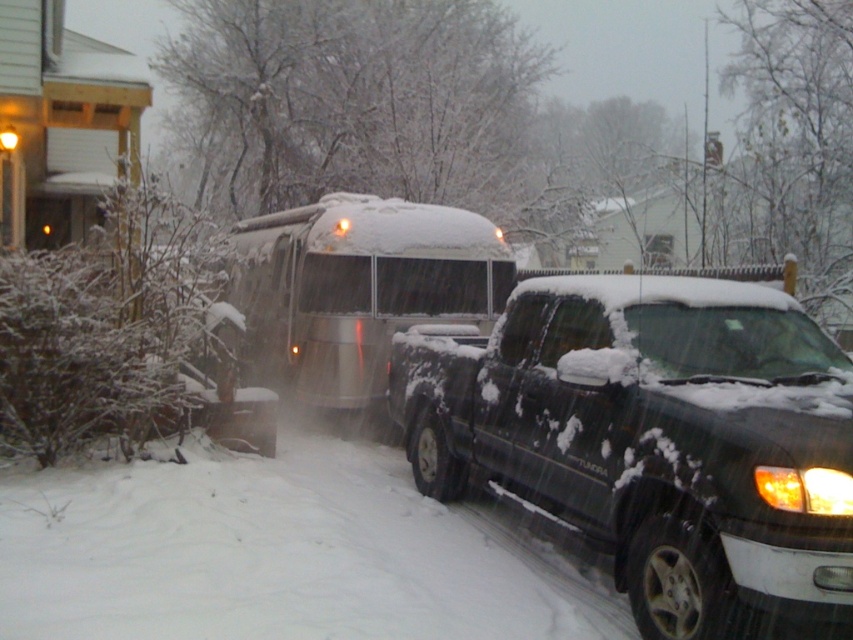
Is black matte truck at center positioned behind silver metallic bus at center?

No, it is in front of silver metallic bus at center.

Is the position of black matte truck at center less distant than that of silver metallic bus at center?

Yes, it is in front of silver metallic bus at center.

Locate an element on the screen. black matte truck at center is located at coordinates (653, 436).

You are a GUI agent. You are given a task and a screenshot of the screen. Output one action in this format:
    pyautogui.click(x=<x>, y=<y>)
    Task: Click on the black matte truck at center
    
    Given the screenshot: What is the action you would take?
    pyautogui.click(x=653, y=436)